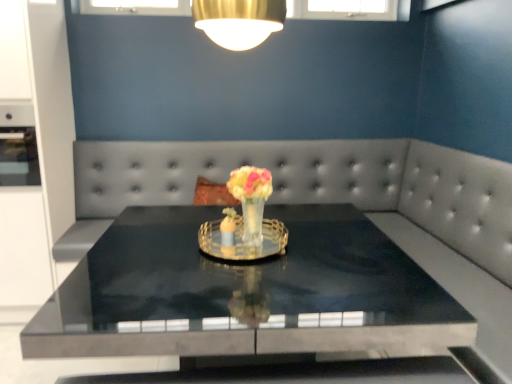
You are a GUI agent. You are given a task and a screenshot of the screen. Output one action in this format:
    pyautogui.click(x=<x>, y=<y>)
    Task: Click on the vacant area located to the right-hand side of translucent glass vase at center
    
    Given the screenshot: What is the action you would take?
    pyautogui.click(x=305, y=252)